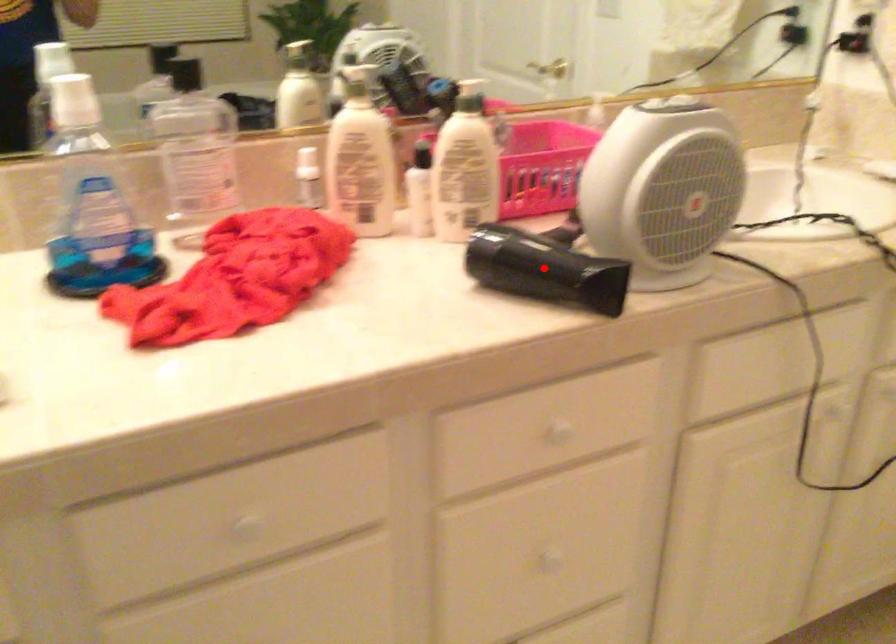
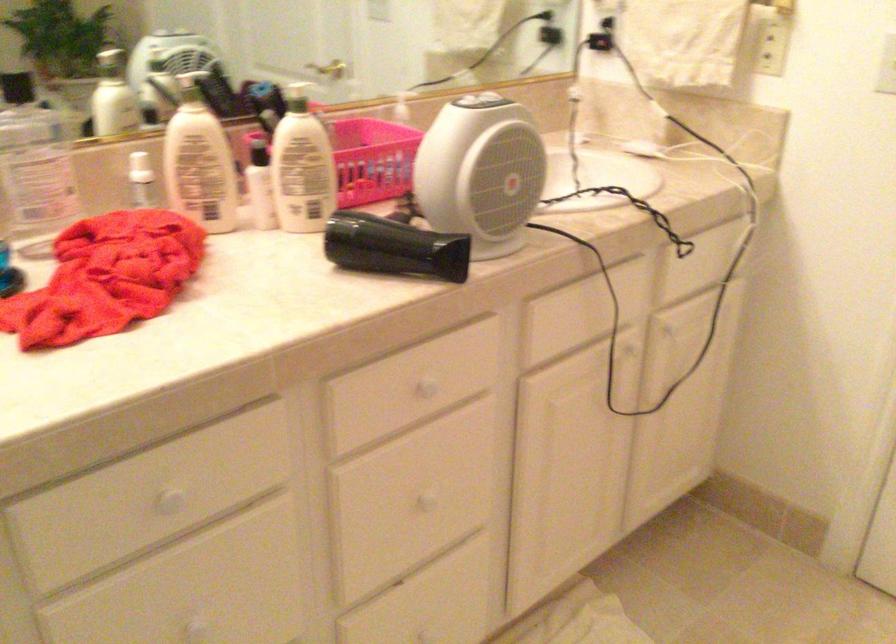
Question: I am providing you with two images of the same scene from different viewpoints. Given a red point in image1, look at the same physical point in image2. Is it:

Choices:
 (A) Closer to the viewpoint
 (B) Farther from the viewpoint

Answer: (B)